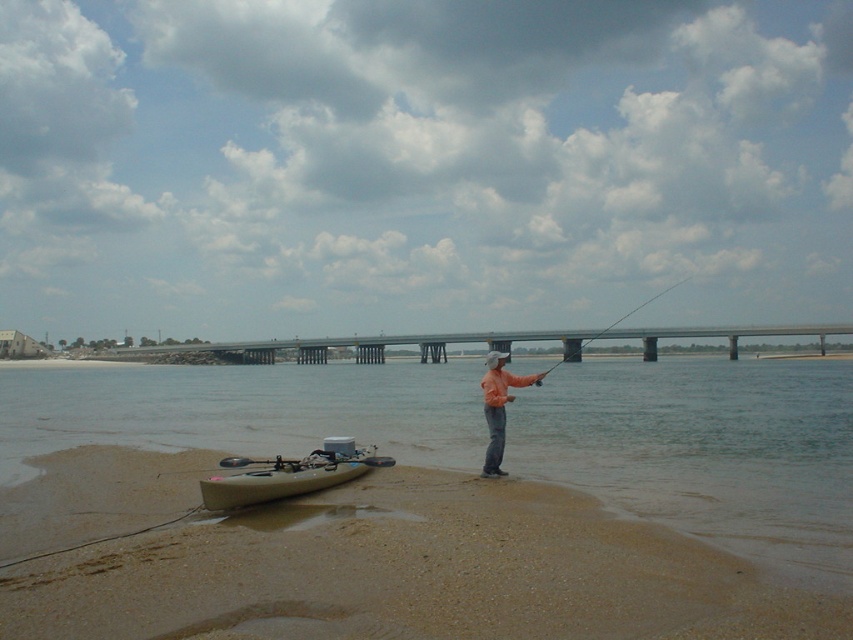
Question: Which is farther from the smooth fiberglass rod at center?

Choices:
 (A) brown matte water at center
 (B) beige plastic kayak at lower left

Answer: (B)

Question: Does tan matte kayak at lower left have a smaller size compared to orange matte jacket at center?

Choices:
 (A) no
 (B) yes

Answer: (B)

Question: Does tan matte kayak at lower left appear on the right side of orange matte jacket at center?

Choices:
 (A) yes
 (B) no

Answer: (B)

Question: Does beige plastic kayak at lower left appear over smooth fiberglass rod at center?

Choices:
 (A) no
 (B) yes

Answer: (A)

Question: Which of the following is the farthest from the observer?

Choices:
 (A) (486, 595)
 (B) (558, 364)

Answer: (B)

Question: Which object is farther from the camera taking this photo?

Choices:
 (A) brown matte water at center
 (B) tan matte kayak at lower left
 (C) beige plastic kayak at lower left

Answer: (B)